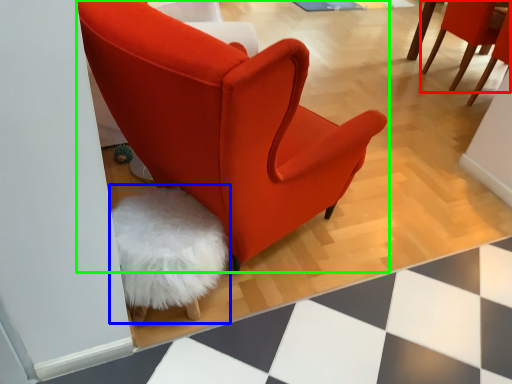
Question: Which object is the farthest from chair (highlighted by a red box)? Choose among these: swivel chair (highlighted by a blue box) or chair (highlighted by a green box).

Choices:
 (A) swivel chair
 (B) chair

Answer: (A)